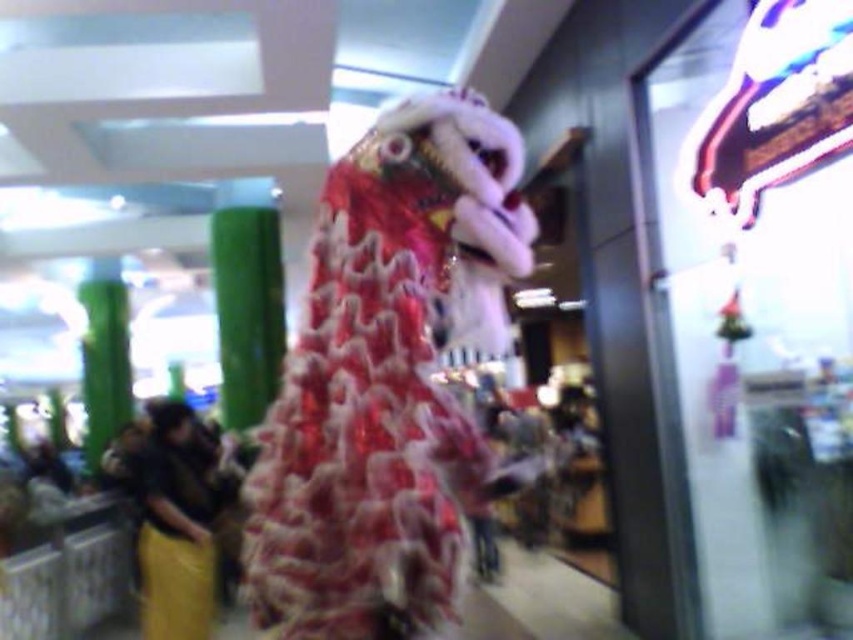
Question: Among these objects, which one is nearest to the camera?

Choices:
 (A) shiny red fabric dragon at center
 (B) green glossy pillar at center
 (C) yellow fabric pants at lower left

Answer: (A)

Question: Is the position of yellow fabric pants at lower left more distant than that of green bamboo pillar at left?

Choices:
 (A) no
 (B) yes

Answer: (A)

Question: Which is farther from the green glossy pillar at center?

Choices:
 (A) yellow fabric pants at lower left
 (B) shiny red fabric dragon at center

Answer: (B)

Question: Which point appears farthest from the camera in this image?

Choices:
 (A) (238, 262)
 (B) (424, 602)
 (C) (167, 477)
 (D) (96, 426)

Answer: (D)

Question: Does shiny red fabric dragon at center have a larger size compared to green glossy pillar at center?

Choices:
 (A) no
 (B) yes

Answer: (A)

Question: Does green glossy pillar at center come behind green bamboo pillar at left?

Choices:
 (A) yes
 (B) no

Answer: (B)